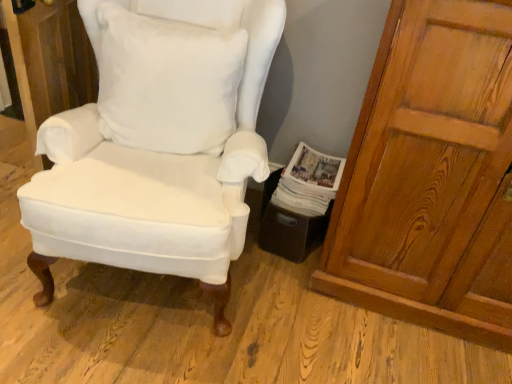
Question: Is matte white cushioned chair at center wider or thinner than wooden door at right?

Choices:
 (A) thin
 (B) wide

Answer: (B)

Question: Visually, is matte white cushioned chair at center positioned to the left or to the right of wooden door at right?

Choices:
 (A) left
 (B) right

Answer: (A)

Question: Considering the real-world distances, which object is farthest from the wooden door at right?

Choices:
 (A) matte white cushioned chair at center
 (B) white cotton pillow at center
 (C) white paper magazine at lower right

Answer: (B)

Question: Which object is the closest to the white paper magazine at lower right?

Choices:
 (A) matte white cushioned chair at center
 (B) wooden door at right
 (C) white cotton pillow at center

Answer: (B)